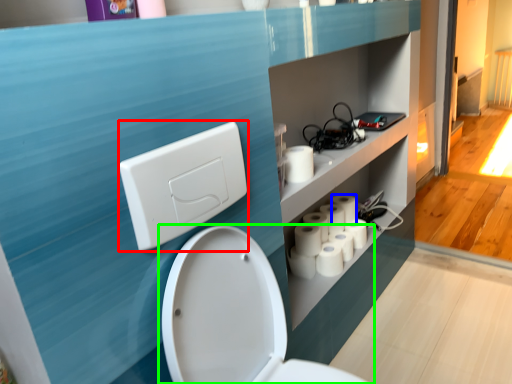
Question: Which is nearer to the light switch (highlighted by a red box)? toilet paper (highlighted by a blue box) or toilet (highlighted by a green box).

Choices:
 (A) toilet paper
 (B) toilet

Answer: (B)